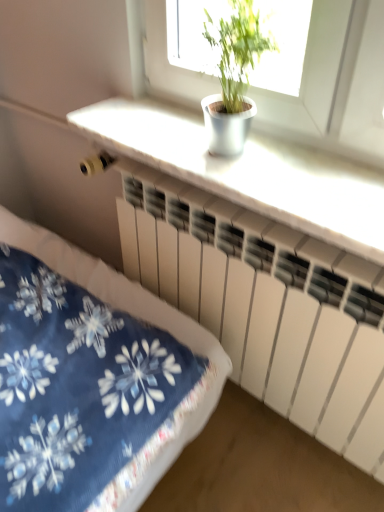
The height and width of the screenshot is (512, 384). Find the location of `vacant space situated on the left part of green leafy plant at upper center`. vacant space situated on the left part of green leafy plant at upper center is located at coordinates (150, 145).